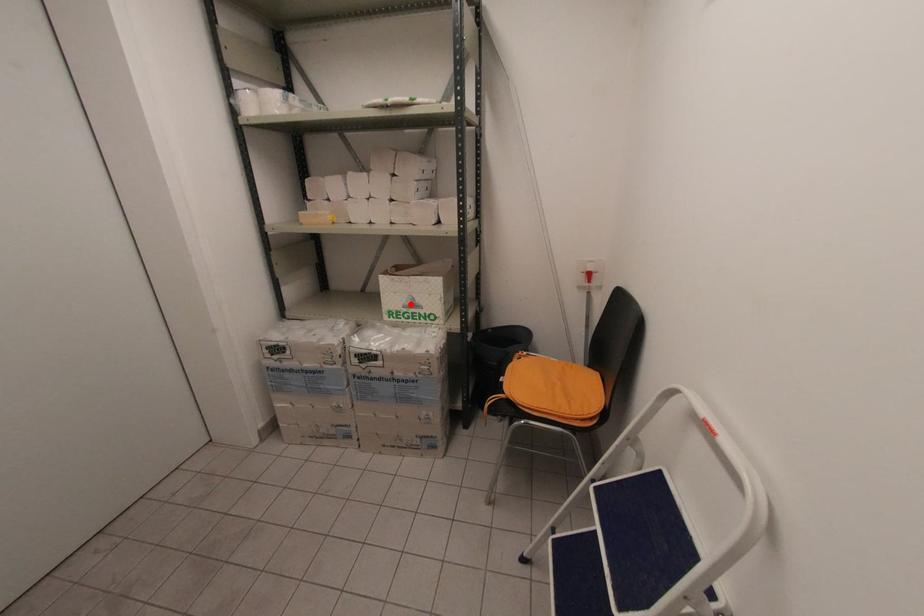
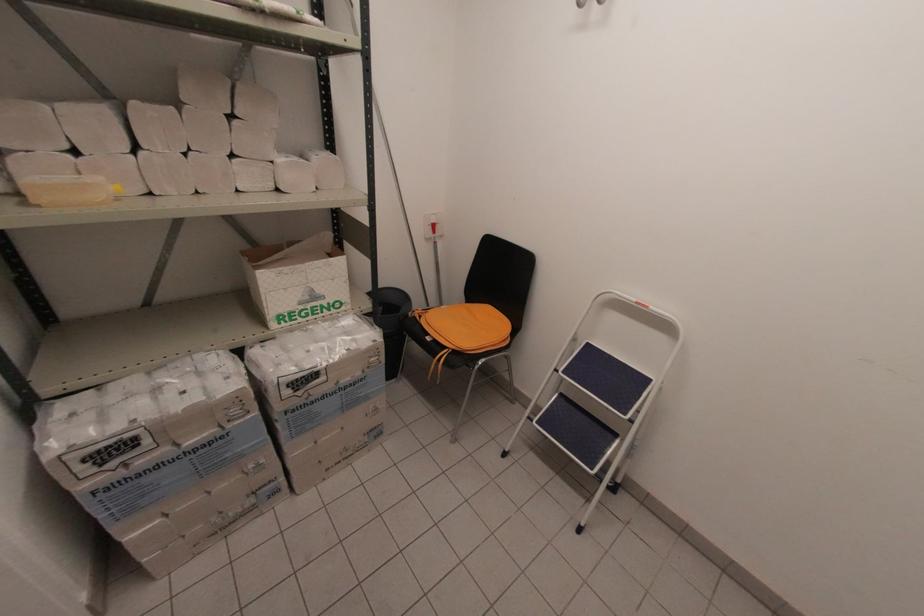
In the second image, find the point that corresponds to the highlighted location in the first image.

(309, 298)